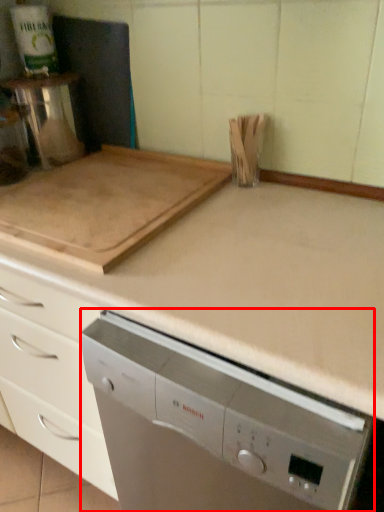
Question: Considering the relative positions of home appliance (annotated by the red box) and kitchen appliance in the image provided, where is home appliance (annotated by the red box) located with respect to the staircase?

Choices:
 (A) left
 (B) right

Answer: (B)